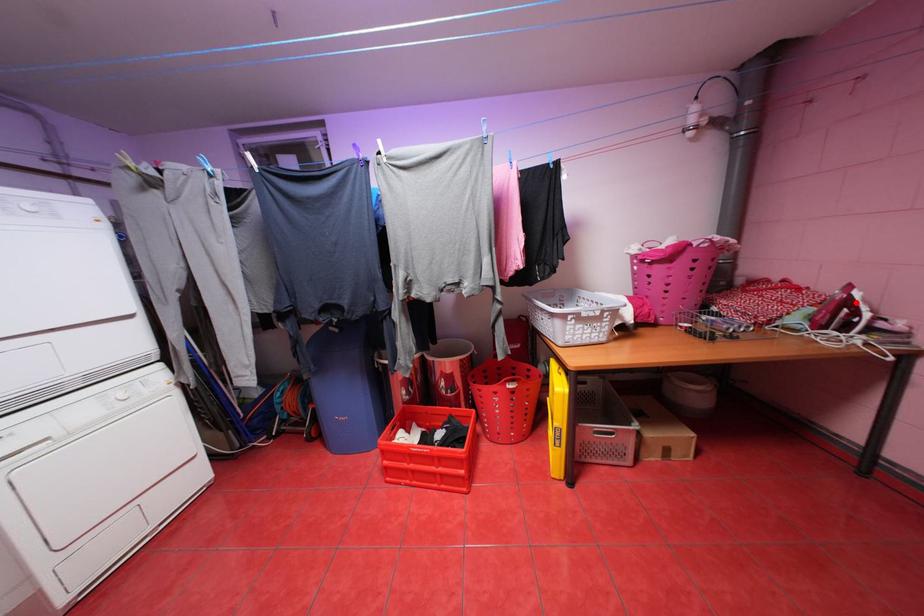
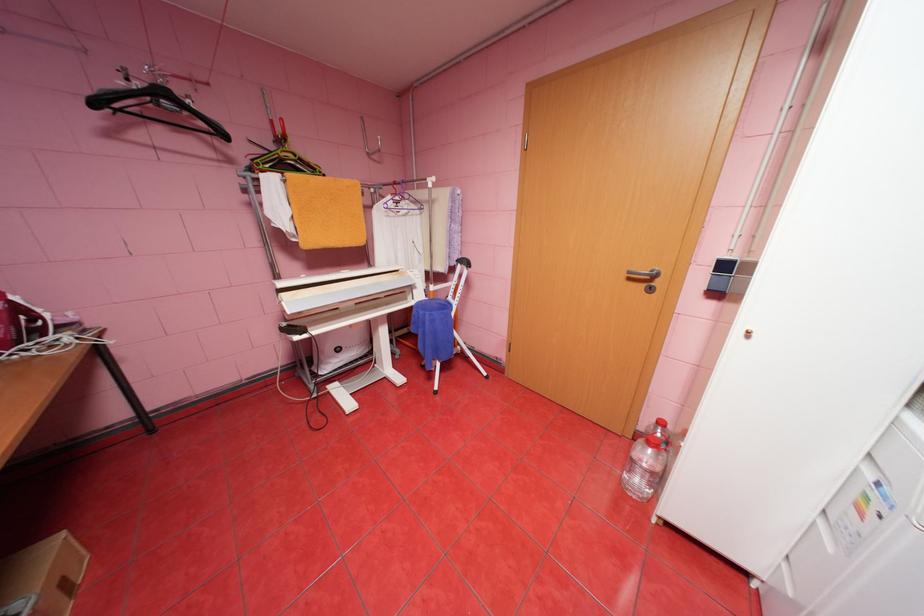
Locate, in the second image, the point that corresponds to the highlighted location in the first image.

(26, 309)